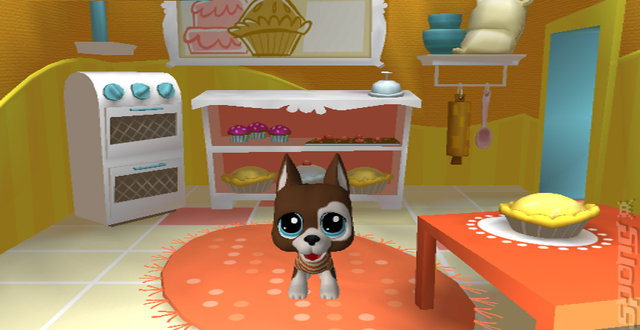
This screenshot has height=330, width=640. I want to click on orange rug, so click(x=236, y=290).